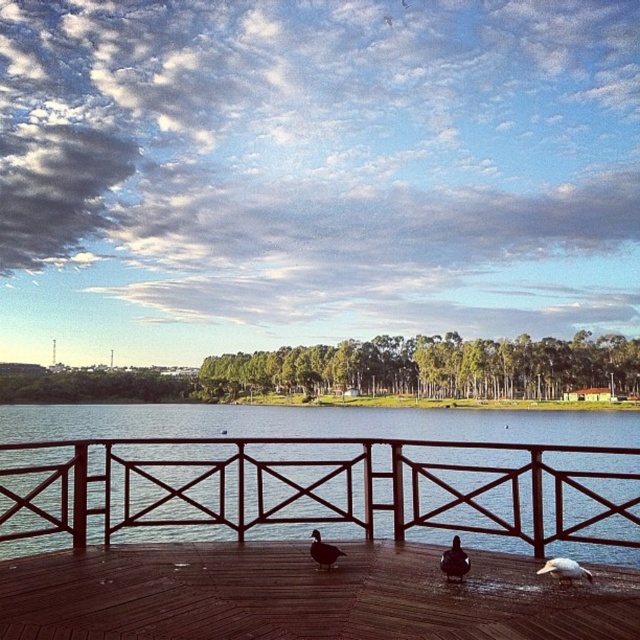
Based on the photo, you are standing on the wooden deck and want to observe the ducks. Which duck is positioned more to the right between the white feathered bird at lower right and the dark brown duck at center?

The white feathered bird at lower right is positioned more to the right than the dark brown duck at center.

You are a birdwatcher observing the ducks on the deck. You notice two objects labeled as dark brown duck at center and dark brown feathers at center. Which object is larger in size?

The dark brown feathers at center are larger than the dark brown duck at center.